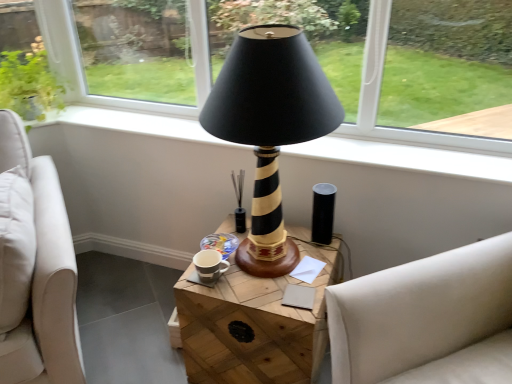
Describe the element at coordinates (137, 49) in the screenshot. I see `transparent glass at upper left` at that location.

Image resolution: width=512 pixels, height=384 pixels. What are the coordinates of `wooden at center` in the screenshot? It's located at (255, 324).

Considering the positions of points (406, 381) and (244, 217), is point (406, 381) farther from camera compared to point (244, 217)?

No, (406, 381) is in front of (244, 217).

Considering their positions, is white fabric studio couch at right located in front of or behind black glossy candle holder at center?

In the image, white fabric studio couch at right appears in front of black glossy candle holder at center.

Is white fabric studio couch at right oriented towards black glossy candle holder at center?

No, white fabric studio couch at right is not aimed at black glossy candle holder at center.

Looking at this image, is white fabric studio couch at right situated inside black glossy candle holder at center or outside?

white fabric studio couch at right lies outside black glossy candle holder at center.

Does white fabric studio couch at right have a lesser width compared to wooden at center?

Incorrect, the width of white fabric studio couch at right is not less than that of wooden at center.

Can we say white fabric studio couch at right lies outside wooden at center?

Answer: white fabric studio couch at right is positioned outside wooden at center.

Considering the positions of points (431, 275) and (237, 290), is point (431, 275) farther from camera compared to point (237, 290)?

That is False.

Is there a large distance between transparent glass at upper left and wooden at center?

Indeed, transparent glass at upper left is not near wooden at center.

Is wooden at center completely or partially inside transparent glass at upper left?

Actually, wooden at center is outside transparent glass at upper left.

Who is smaller, transparent glass at upper left or wooden at center?

With smaller size is transparent glass at upper left.

How different are the orientations of transparent glass at upper left and wooden at center in degrees?

The facing directions of transparent glass at upper left and wooden at center are 0.675 degrees apart.

Is black glossy candle holder at center to the right of black striped wood lamp at center from the viewer's perspective?

No.

Who is shorter, black glossy candle holder at center or black striped wood lamp at center?

black glossy candle holder at center.

Where is `lamp that is above the black glossy candle holder at center (from the image's perspective)`? The image size is (512, 384). lamp that is above the black glossy candle holder at center (from the image's perspective) is located at coordinates (270, 127).

Is black glossy candle holder at center not close to black striped wood lamp at center?

That's not correct — black glossy candle holder at center is a little close to black striped wood lamp at center.

Is transparent glass at upper left directly adjacent to white fabric studio couch at right?

transparent glass at upper left is not next to white fabric studio couch at right, and they're not touching.

Considering the relative sizes of transparent glass at upper left and white fabric studio couch at right in the image provided, is transparent glass at upper left smaller than white fabric studio couch at right?

Yes.

Which is more to the right, transparent glass at upper left or white fabric studio couch at right?

white fabric studio couch at right.

Based on their positions, is white fabric studio couch at right located to the left or right of black striped wood lamp at center?

Based on their positions, white fabric studio couch at right is located to the right of black striped wood lamp at center.

Considering the positions of objects white fabric studio couch at right and black striped wood lamp at center in the image provided, who is in front, white fabric studio couch at right or black striped wood lamp at center?

white fabric studio couch at right is more forward.

The width and height of the screenshot is (512, 384). Identify the location of studio couch that is in front of the black striped wood lamp at center. (426, 319).

Considering the relative sizes of white fabric studio couch at right and black striped wood lamp at center in the image provided, is white fabric studio couch at right taller than black striped wood lamp at center?

Yes.

Would you say black striped wood lamp at center contains transparent glass at upper left?

No, transparent glass at upper left is not surrounded by black striped wood lamp at center.

Consider the image. Can you tell me how much black striped wood lamp at center and transparent glass at upper left differ in facing direction?

The angular difference between black striped wood lamp at center and transparent glass at upper left is 0.675 degrees.

Is black striped wood lamp at center at the right side of transparent glass at upper left?

Yes, black striped wood lamp at center is to the right of transparent glass at upper left.

From their relative heights in the image, would you say black striped wood lamp at center is taller or shorter than transparent glass at upper left?

Considering their sizes, black striped wood lamp at center has more height than transparent glass at upper left.

Find the location of a particular element. Image resolution: width=512 pixels, height=384 pixels. candle holder above the white fabric studio couch at right (from the image's perspective) is located at coordinates (239, 201).

You are a GUI agent. You are given a task and a screenshot of the screen. Output one action in this format:
    pyautogui.click(x=<x>, y=<y>)
    Task: Click on the studio couch above the wooden at center (from a real-world perspective)
    This screenshot has height=384, width=512.
    Given the screenshot: What is the action you would take?
    pyautogui.click(x=426, y=319)

Based on their spatial positions, is black striped wood lamp at center or white fabric studio couch at right further from black glossy candle holder at center?

white fabric studio couch at right is further to black glossy candle holder at center.

When comparing their distances from wooden at center, does black glossy candle holder at center or white fabric studio couch at right seem closer?

Among the two, white fabric studio couch at right is located nearer to wooden at center.

Which object lies further to the anchor point black glossy candle holder at center, wooden at center or white fabric studio couch at right?

white fabric studio couch at right lies further to black glossy candle holder at center than the other object.

Looking at the image, which one is located closer to white fabric studio couch at right, black striped wood lamp at center or wooden at center?

wooden at center is closer to white fabric studio couch at right.

Considering their positions, is wooden at center positioned further to white fabric studio couch at right than black glossy candle holder at center?

black glossy candle holder at center lies further to white fabric studio couch at right than the other object.

Estimate the real-world distances between objects in this image. Which object is closer to white fabric studio couch at right, black striped wood lamp at center or black glossy candle holder at center?

Based on the image, black striped wood lamp at center appears to be nearer to white fabric studio couch at right.

Which object lies nearer to the anchor point black striped wood lamp at center, transparent glass at upper left or black glossy candle holder at center?

Among the two, black glossy candle holder at center is located nearer to black striped wood lamp at center.

Based on their spatial positions, is white fabric studio couch at right or wooden at center further from black glossy candle holder at center?

white fabric studio couch at right.

Locate an element on the screen. The width and height of the screenshot is (512, 384). candle holder between black striped wood lamp at center and transparent glass at upper left along the z-axis is located at coordinates (239, 201).

What are the coordinates of `table between white fabric studio couch at right and black glossy candle holder at center along the z-axis` in the screenshot? It's located at (255, 324).

Find the location of a particular element. The image size is (512, 384). lamp located between white fabric studio couch at right and black glossy candle holder at center in the depth direction is located at coordinates (270, 127).

Locate an element on the screen. The width and height of the screenshot is (512, 384). lamp between transparent glass at upper left and wooden at center vertically is located at coordinates (270, 127).